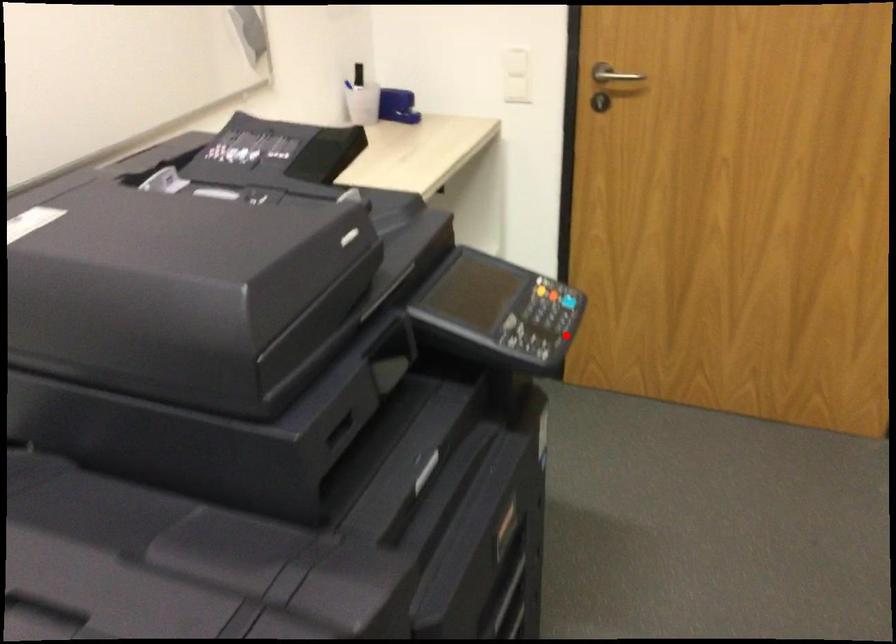
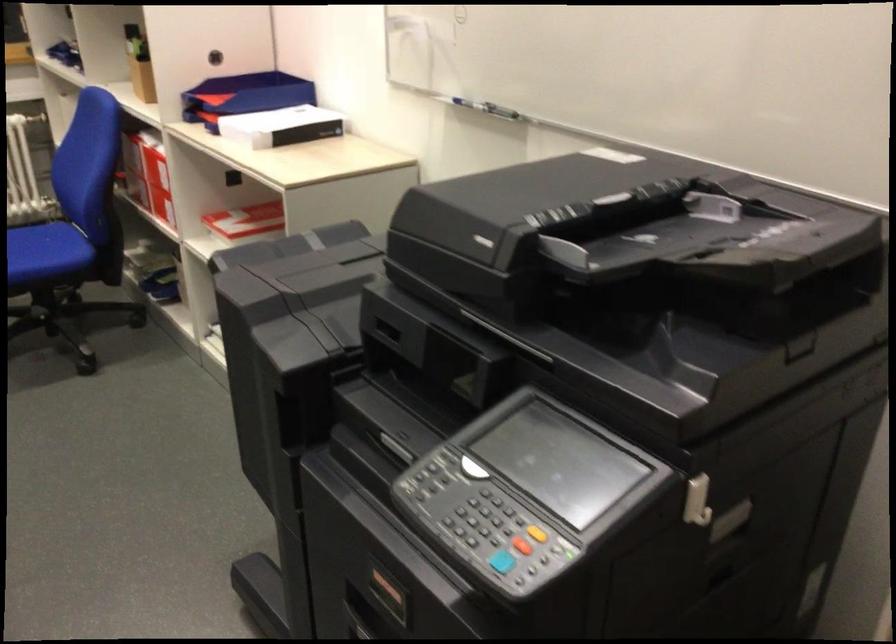
Locate, in the second image, the point that corresponds to the highlighted location in the first image.

(502, 562)